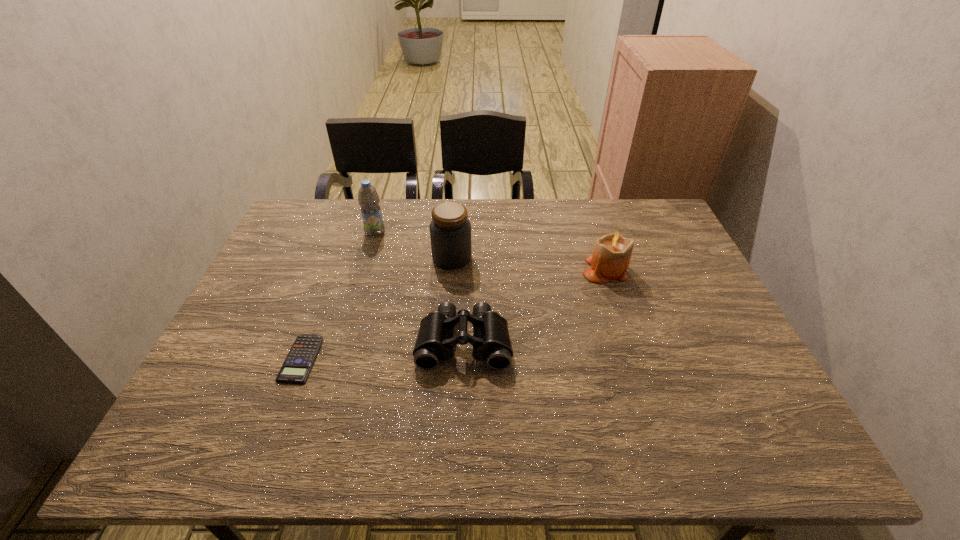
Locate an element on the screen. The height and width of the screenshot is (540, 960). vacant area in the image that satisfies the following two spatial constraints: 1. on the back side of the leftmost object; 2. on the right side of the water bottle is located at coordinates (348, 232).